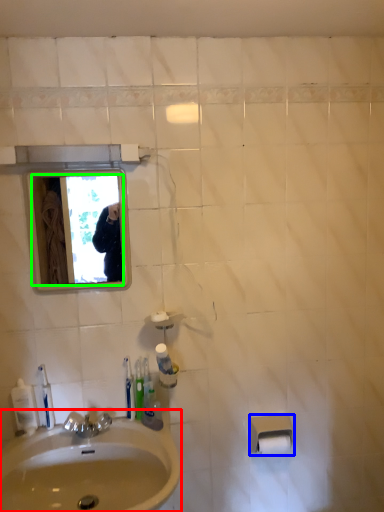
Question: Based on their relative distances, which object is farther from sink (highlighted by a red box)? Choose from toilet paper (highlighted by a blue box) and mirror (highlighted by a green box).

Choices:
 (A) toilet paper
 (B) mirror

Answer: (B)